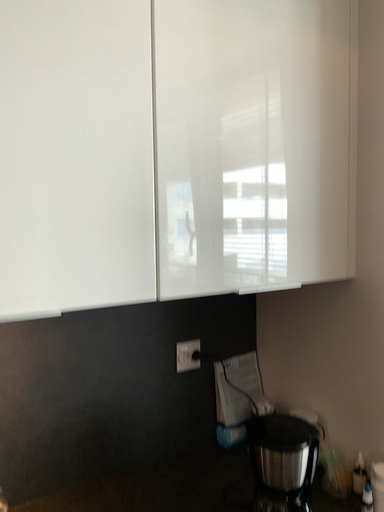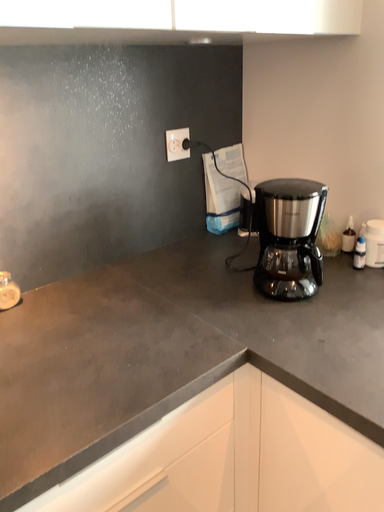
Question: Which way did the camera rotate in the video?

Choices:
 (A) rotated left
 (B) rotated right

Answer: (B)